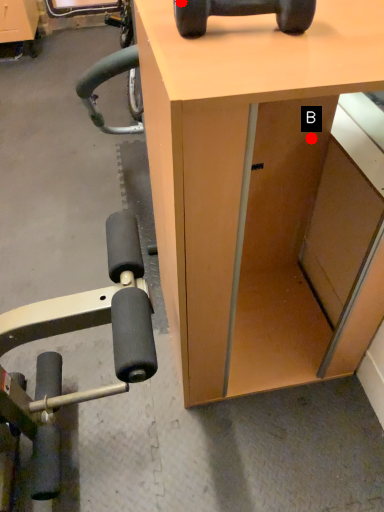
Question: Two points are circled on the image, labeled by A and B beside each circle. Which of the following is the closest to the observer?

Choices:
 (A) A is closer
 (B) B is closer

Answer: (A)